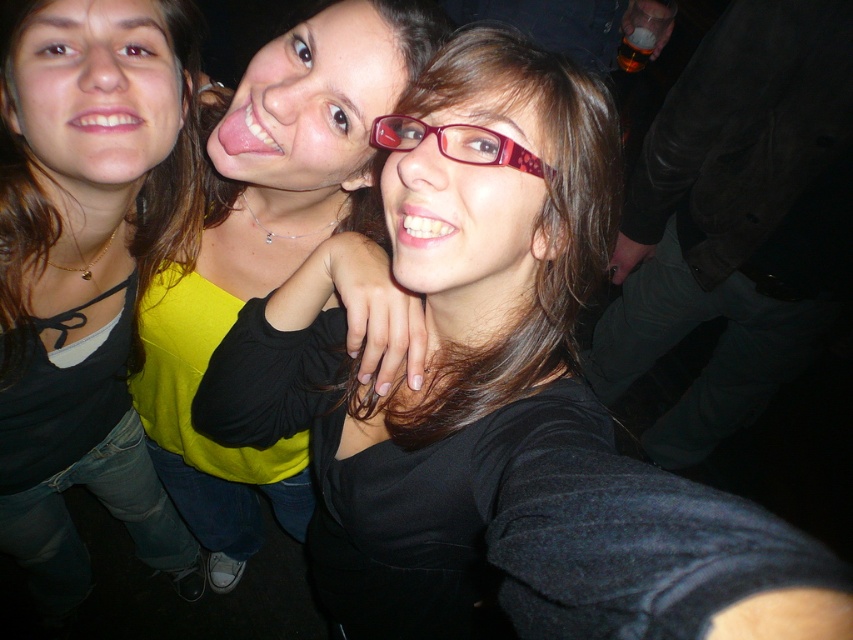
Question: Which point is closer to the camera taking this photo?

Choices:
 (A) (677, 108)
 (B) (201, 381)

Answer: (B)

Question: Which object is the closest to the yellow matte sweater at center?

Choices:
 (A) dark green corduroy pants at lower right
 (B) matte black top at center

Answer: (B)

Question: In this image, where is yellow matte sweater at center located relative to matte red glasses at center?

Choices:
 (A) left
 (B) right

Answer: (A)

Question: Does matte black top at center lie behind matte red glasses at center?

Choices:
 (A) no
 (B) yes

Answer: (B)

Question: Does matte black shirt at center appear over yellow matte sweater at center?

Choices:
 (A) yes
 (B) no

Answer: (A)

Question: Which is nearer to the matte red glasses at center?

Choices:
 (A) dark green corduroy pants at lower right
 (B) matte black top at center
 (C) yellow matte sweater at center

Answer: (C)